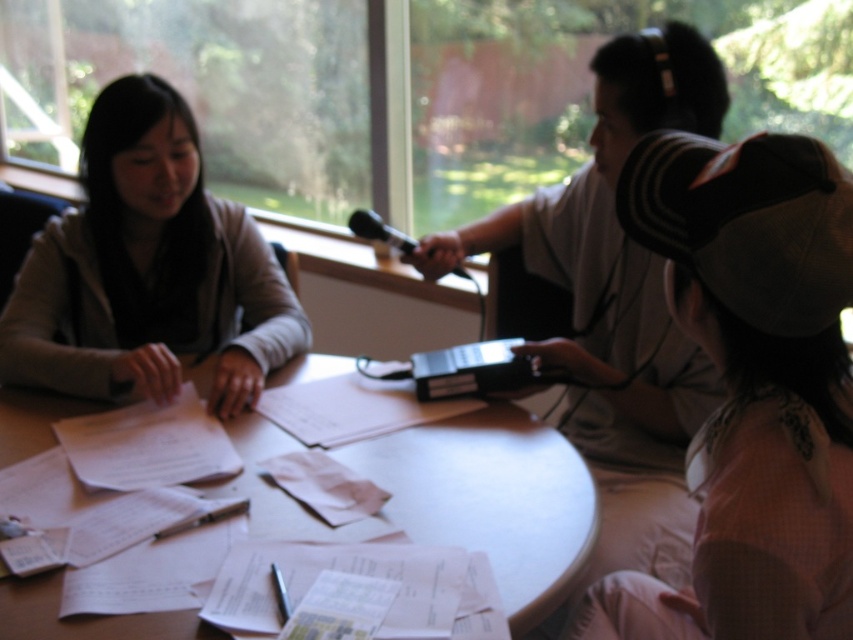
Question: Which point appears closest to the camera in this image?

Choices:
 (A) (100, 204)
 (B) (421, 502)
 (C) (165, 445)
 (D) (604, 616)

Answer: (D)

Question: Which point appears closest to the camera in this image?

Choices:
 (A) (218, 448)
 (B) (792, 320)
 (C) (115, 332)
 (D) (245, 422)

Answer: (B)

Question: Can you confirm if white mesh cap at lower right is positioned to the left of light brown sweater at left?

Choices:
 (A) no
 (B) yes

Answer: (A)

Question: Is white wooden table at center behind white paper at center?

Choices:
 (A) no
 (B) yes

Answer: (A)

Question: Is light brown sweater at left to the right of white paper at center from the viewer's perspective?

Choices:
 (A) no
 (B) yes

Answer: (A)

Question: Which is farther from the light brown sweater at left?

Choices:
 (A) white mesh cap at lower right
 (B) white wooden table at center
 (C) white paper at center

Answer: (A)